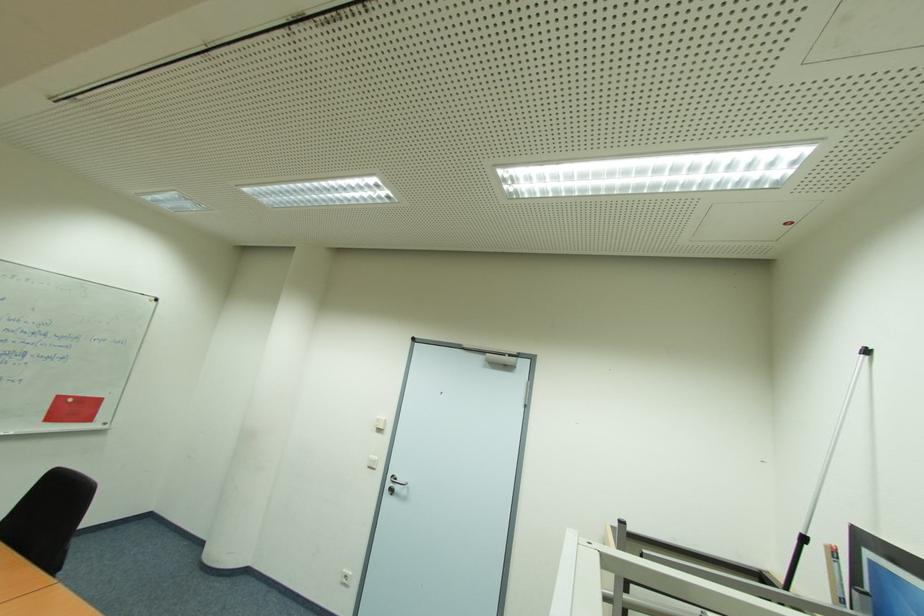
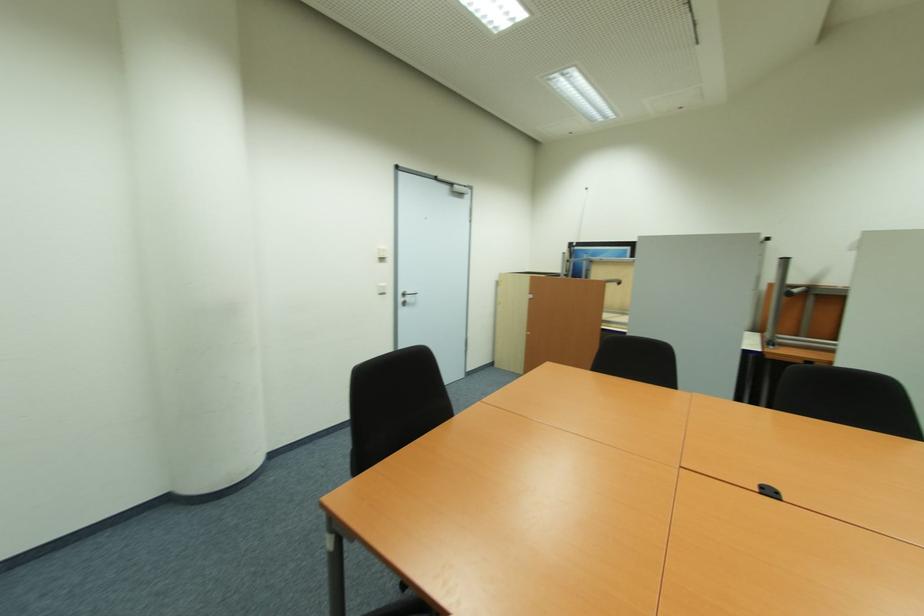
Locate, in the second image, the point that corresponds to pixel 372 468 in the first image.

(383, 294)